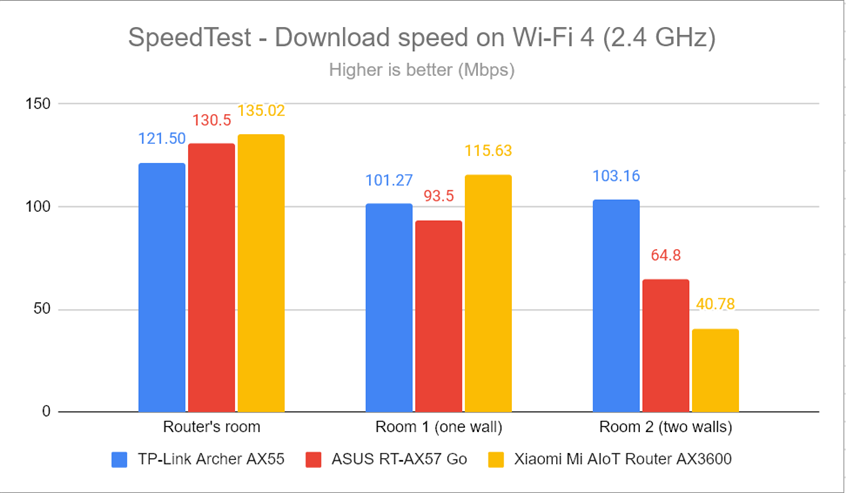
Where is `router's room`? router's room is located at coordinates (169, 425).